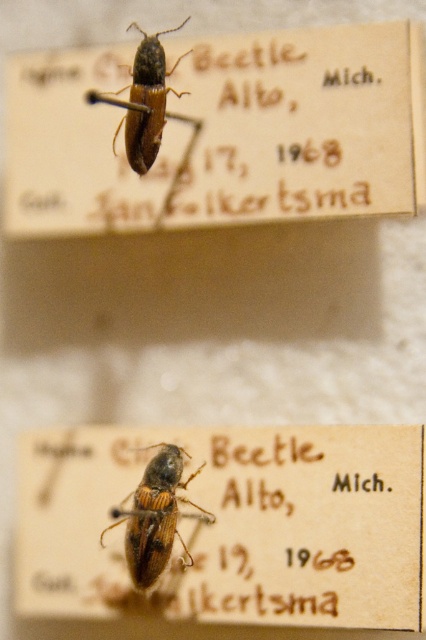
Question: Among these points, which one is farthest from the camera?

Choices:
 (A) (138, 100)
 (B) (94, 113)

Answer: (B)

Question: Is matte brown beetle at upper center bigger than brown matte beetle at center?

Choices:
 (A) yes
 (B) no

Answer: (A)

Question: Which is farther from the matte brown wood at center?

Choices:
 (A) brown matte beetle at center
 (B) shiny brown beetle at upper center
 (C) matte brown beetle at upper center

Answer: (B)

Question: Which of the following is the farthest from the observer?

Choices:
 (A) brown matte beetle at center
 (B) shiny brown beetle at upper center

Answer: (A)

Question: Can you confirm if matte brown beetle at upper center is positioned above matte brown wood at center?

Choices:
 (A) yes
 (B) no

Answer: (A)

Question: Does matte brown beetle at upper center lie behind matte brown wood at center?

Choices:
 (A) no
 (B) yes

Answer: (B)